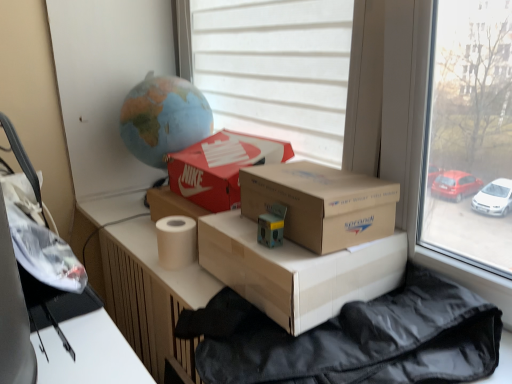
Question: Does beige matte toilet paper at center have a greater height compared to matte cardboard box at center, which is the first box from top to bottom?

Choices:
 (A) no
 (B) yes

Answer: (A)

Question: Does beige matte toilet paper at center have a greater width compared to matte cardboard box at center, which is the first box from top to bottom?

Choices:
 (A) no
 (B) yes

Answer: (A)

Question: Is beige matte toilet paper at center facing towards matte cardboard box at center, the 3th box in the bottom-to-top sequence?

Choices:
 (A) no
 (B) yes

Answer: (A)

Question: Considering the relative sizes of beige matte toilet paper at center and matte cardboard box at center, which is the first box from top to bottom, in the image provided, is beige matte toilet paper at center smaller than matte cardboard box at center, which is the first box from top to bottom,?

Choices:
 (A) yes
 (B) no

Answer: (A)

Question: Is beige matte toilet paper at center positioned with its back to matte cardboard box at center, the 3th box in the bottom-to-top sequence?

Choices:
 (A) yes
 (B) no

Answer: (B)

Question: From a real-world perspective, is beige matte toilet paper at center beneath matte cardboard box at center, the 3th box in the bottom-to-top sequence?

Choices:
 (A) no
 (B) yes

Answer: (B)

Question: Does transparent glass window at upper right, acting as the 1th window starting from the right, have a lesser height compared to white cardboard box at center?

Choices:
 (A) no
 (B) yes

Answer: (A)

Question: Is the position of transparent glass window at upper right, acting as the 1th window starting from the right, more distant than that of white cardboard box at center?

Choices:
 (A) no
 (B) yes

Answer: (A)

Question: Considering the relative sizes of transparent glass window at upper right, acting as the 1th window starting from the right, and white cardboard box at center in the image provided, is transparent glass window at upper right, acting as the 1th window starting from the right, smaller than white cardboard box at center?

Choices:
 (A) no
 (B) yes

Answer: (A)

Question: Is white cardboard box at center a part of transparent glass window at upper right, acting as the second window starting from the left?

Choices:
 (A) yes
 (B) no

Answer: (B)

Question: Could you tell me if transparent glass window at upper right, acting as the second window starting from the left, is facing white cardboard box at center?

Choices:
 (A) yes
 (B) no

Answer: (B)

Question: Considering the relative positions of transparent glass window at upper right, acting as the 1th window starting from the right, and white cardboard box at center in the image provided, is transparent glass window at upper right, acting as the 1th window starting from the right, to the right of white cardboard box at center from the viewer's perspective?

Choices:
 (A) no
 (B) yes

Answer: (A)

Question: Is matte cardboard box at center, which is the 3th box from top to bottom, completely or partially outside of white matte window at center, the 1th window from the left?

Choices:
 (A) no
 (B) yes

Answer: (B)